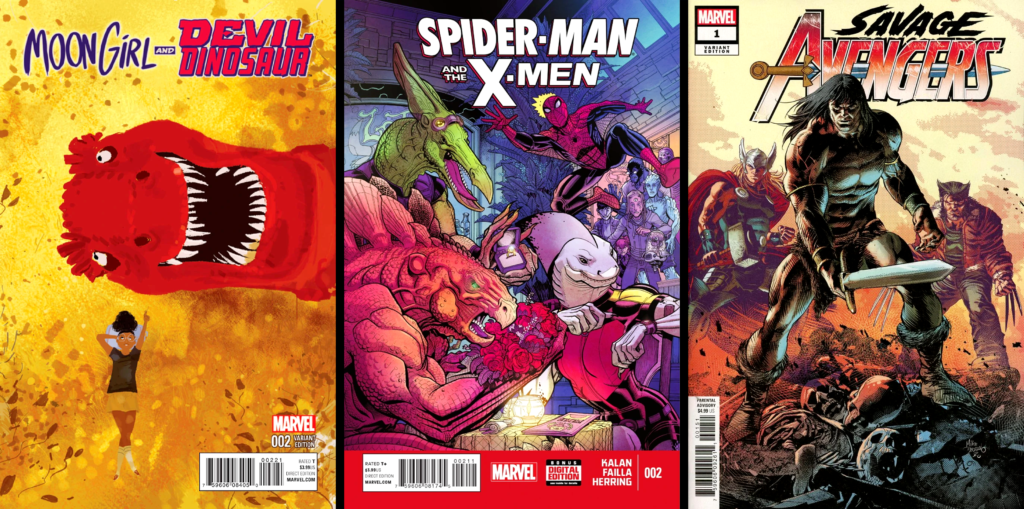
Find the location of a particular element. The height and width of the screenshot is (509, 1024). action figure is located at coordinates (852, 194), (848, 212), (847, 153), (801, 313), (900, 312).